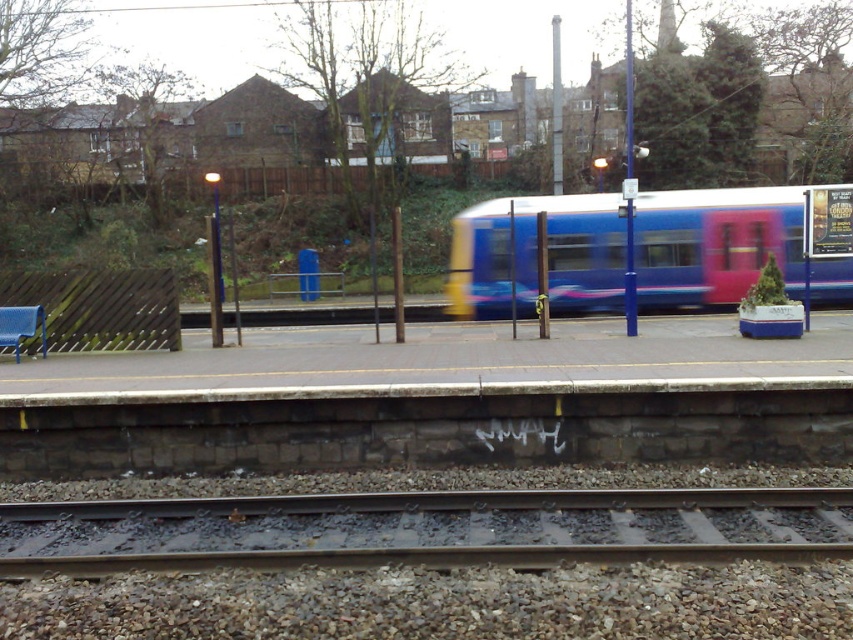
You are standing on the platform at the railway station and want to determine the relative positions of two points marked on the platform. The first point is at coordinates point (607, 522) and the second is at point (602, 209). Based on the scene description, which point is closer to you?

Point (607, 522) is closer to the viewer than point (602, 209).

You are a passenger waiting at the railway station. You see the metal at bottom and the blue glossy train at center. Which object is closer to the ground?

The metal at bottom is closer to the ground because it is located below the blue glossy train at center.

You are a passenger waiting at the station. You see the metal at bottom and the blue glossy train at center. Which object is closer to you?

The metal at bottom is closer to you because it is in front of the blue glossy train at center.